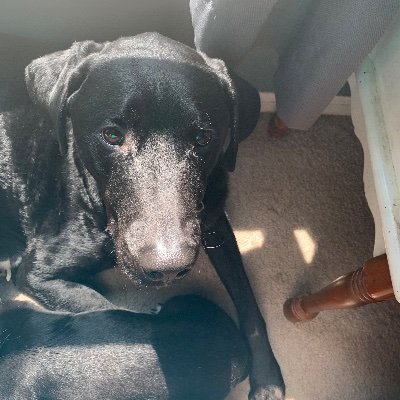
This screenshot has height=400, width=400. I want to click on sunlight shining through the window, so click(x=248, y=240), click(x=305, y=239).